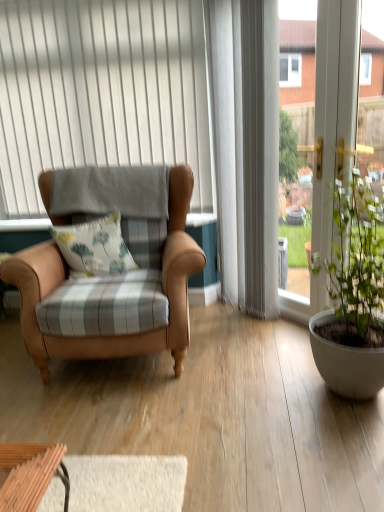
Question: Is leather armchair at left facing away from white textured curtain at upper center?

Choices:
 (A) no
 (B) yes

Answer: (A)

Question: Is leather armchair at left surrounding white textured curtain at upper center?

Choices:
 (A) yes
 (B) no

Answer: (B)

Question: Can you confirm if leather armchair at left is thinner than white textured curtain at upper center?

Choices:
 (A) no
 (B) yes

Answer: (A)

Question: Does leather armchair at left have a greater height compared to white textured curtain at upper center?

Choices:
 (A) yes
 (B) no

Answer: (B)

Question: From a real-world perspective, is leather armchair at left positioned over white textured curtain at upper center based on gravity?

Choices:
 (A) yes
 (B) no

Answer: (B)

Question: Would you say white plastic window frame at right is to the left or to the right of white textured curtain at upper center in the picture?

Choices:
 (A) left
 (B) right

Answer: (B)

Question: Is white plastic window frame at right wider or thinner than white textured curtain at upper center?

Choices:
 (A) thin
 (B) wide

Answer: (B)

Question: From a real-world perspective, is white plastic window frame at right above or below white textured curtain at upper center?

Choices:
 (A) above
 (B) below

Answer: (B)

Question: Is point (322, 28) positioned closer to the camera than point (163, 2)?

Choices:
 (A) farther
 (B) closer

Answer: (B)

Question: Visually, is floral fabric cushion at center positioned to the left or to the right of matte white pot at right?

Choices:
 (A) right
 (B) left

Answer: (B)

Question: Is point (125, 252) closer or farther from the camera than point (354, 249)?

Choices:
 (A) farther
 (B) closer

Answer: (A)

Question: Would you say floral fabric cushion at center is inside or outside matte white pot at right?

Choices:
 (A) outside
 (B) inside

Answer: (A)

Question: From a real-world perspective, is floral fabric cushion at center positioned above or below matte white pot at right?

Choices:
 (A) below
 (B) above

Answer: (B)

Question: Relative to white plastic window frame at right, is white textured curtain at upper center in front or behind?

Choices:
 (A) front
 (B) behind

Answer: (B)

Question: Would you say white textured curtain at upper center is to the left or to the right of white plastic window frame at right in the picture?

Choices:
 (A) right
 (B) left

Answer: (B)